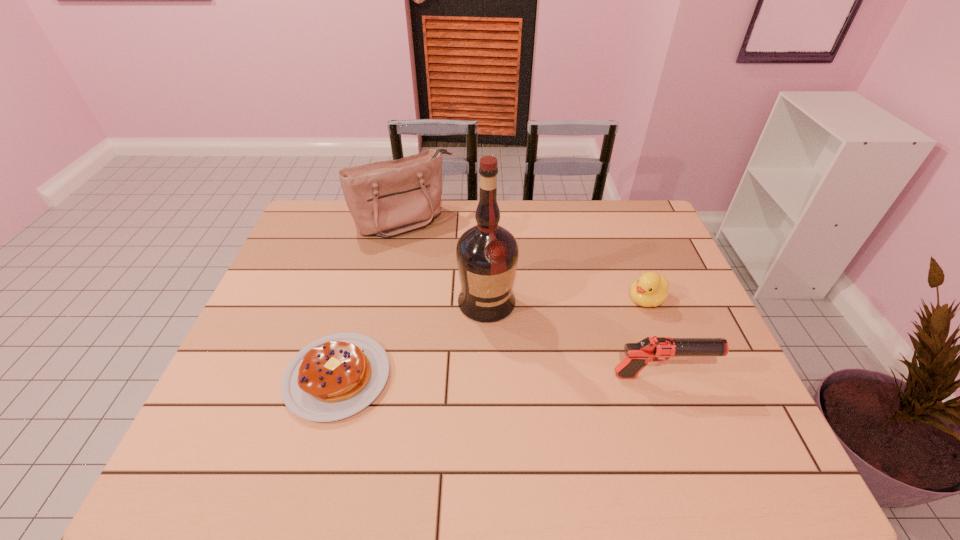
At what (x,y) coordinates should I click in order to perform the action: click on vacant space on the desktop that is between the pancake and the gun and is positioned on the surface of the tallest object. Please return your answer as a coordinate pair (x, y). Looking at the image, I should click on (525, 376).

The width and height of the screenshot is (960, 540). What are the coordinates of `free space on the desktop that is between the shortest object and the gun and is positioned on the beak of the second shortest object` in the screenshot? It's located at (534, 376).

This screenshot has height=540, width=960. What are the coordinates of `free space on the desktop that is between the pancake and the third tallest object and is positioned on the front pocket of the shoulder bag` in the screenshot? It's located at (515, 376).